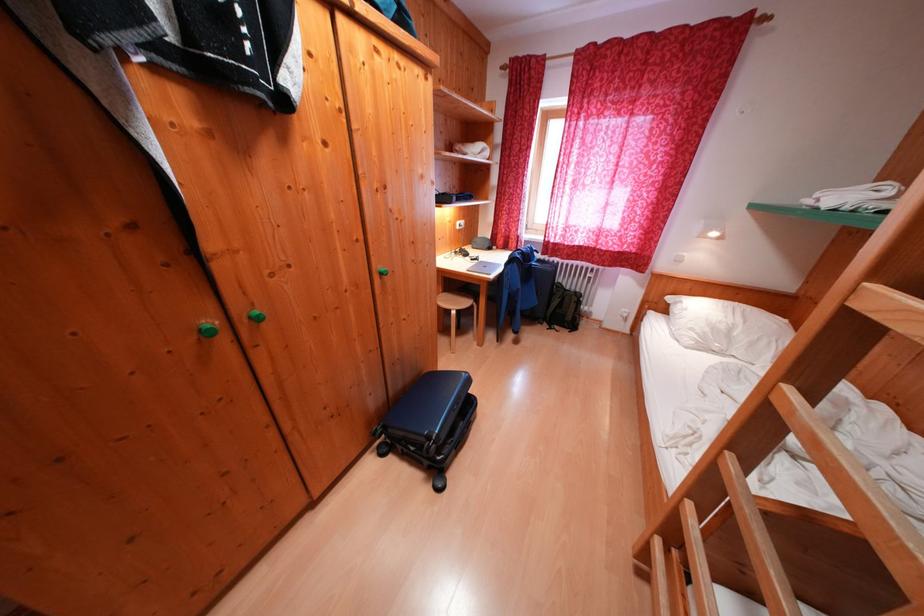
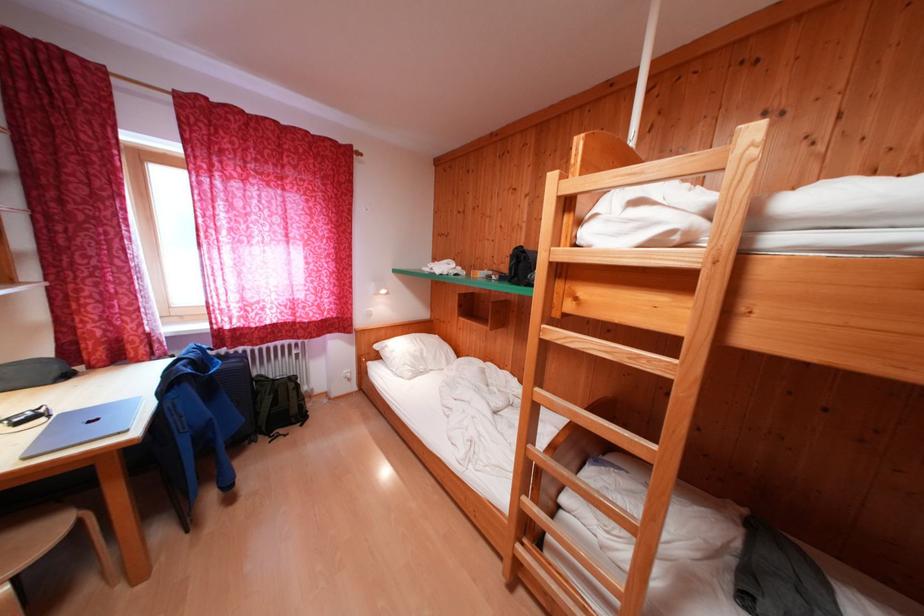
Locate, in the second image, the point that corresponds to the point at 492,275 in the first image.

(104, 434)